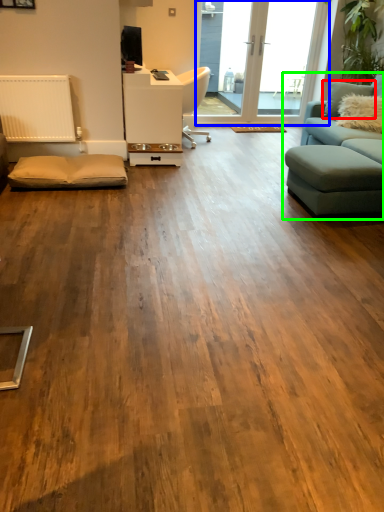
Question: Which object is positioned farthest from pillow (highlighted by a red box)? Select from window screen (highlighted by a blue box) and studio couch (highlighted by a green box).

Choices:
 (A) window screen
 (B) studio couch

Answer: (B)